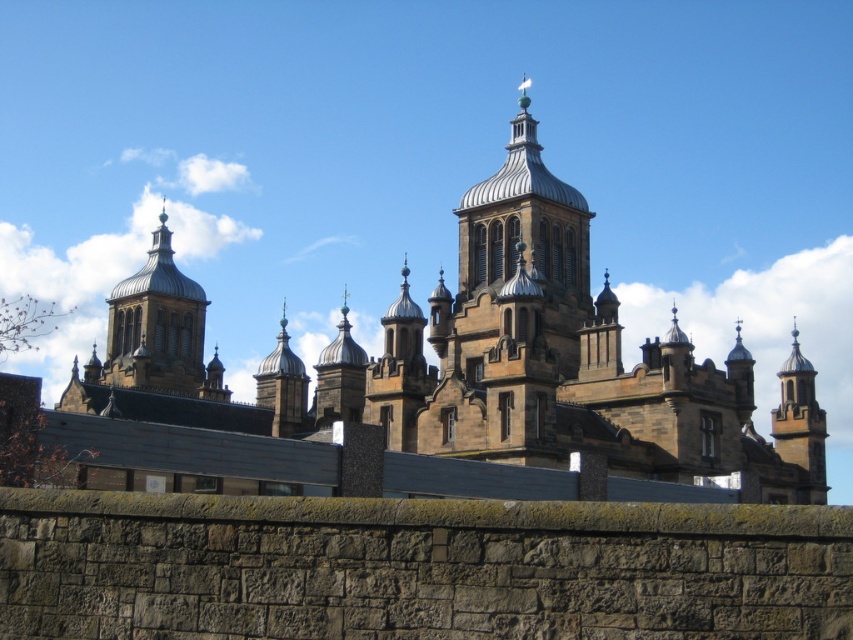
You are an architect planning to place a new sculpture between the brown stone church at center and the smooth stone tower at right. Given their widths, which structure should the sculpture be closer to ensure it fits proportionally?

The brown stone church at center is wider than the smooth stone tower at right. To ensure the sculpture fits proportionally, it should be placed closer to the smooth stone tower at right since it is narrower.

You are standing in front of a historic building and notice the matte gold dome at center. If you want to take a photo that includes the entire dome without any cropping, what should you consider about your current distance?

The matte gold dome at center is 126.28 meters from camera. To capture the entire dome in the photo without cropping, you need to ensure you are positioned at least 126.28 meters away from the dome.